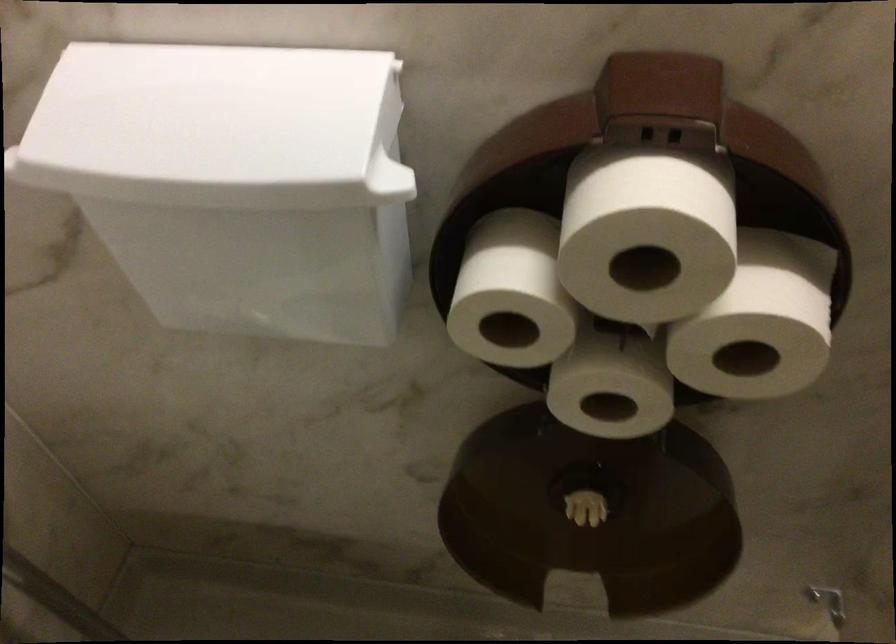
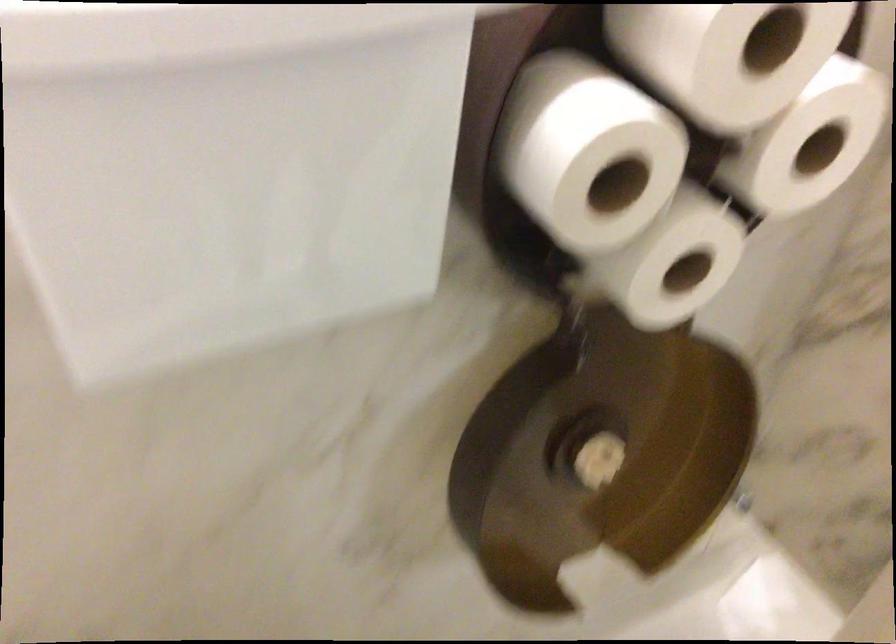
Where in the second image is the point corresponding to point (785, 342) from the first image?

(808, 142)